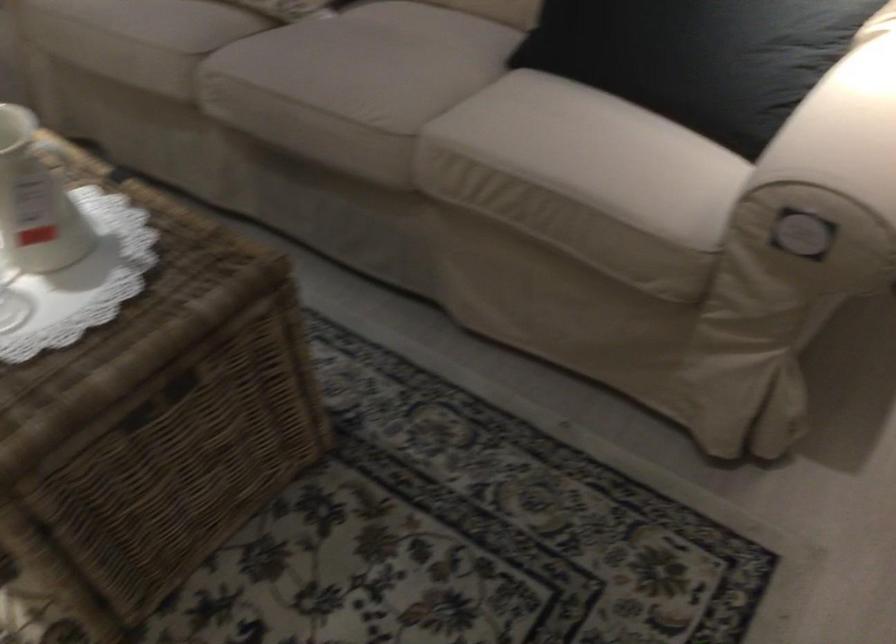
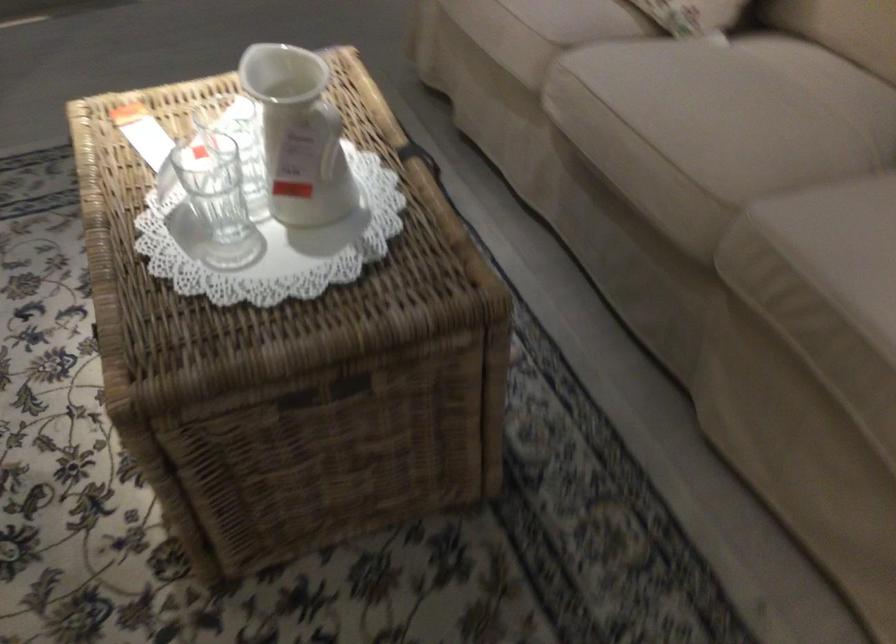
Question: The camera is either moving clockwise (left) or counter-clockwise (right) around the object. The first image is from the beginning of the video and the second image is from the end. Is the camera moving left or right when shooting the video?

Choices:
 (A) Left
 (B) Right

Answer: (B)